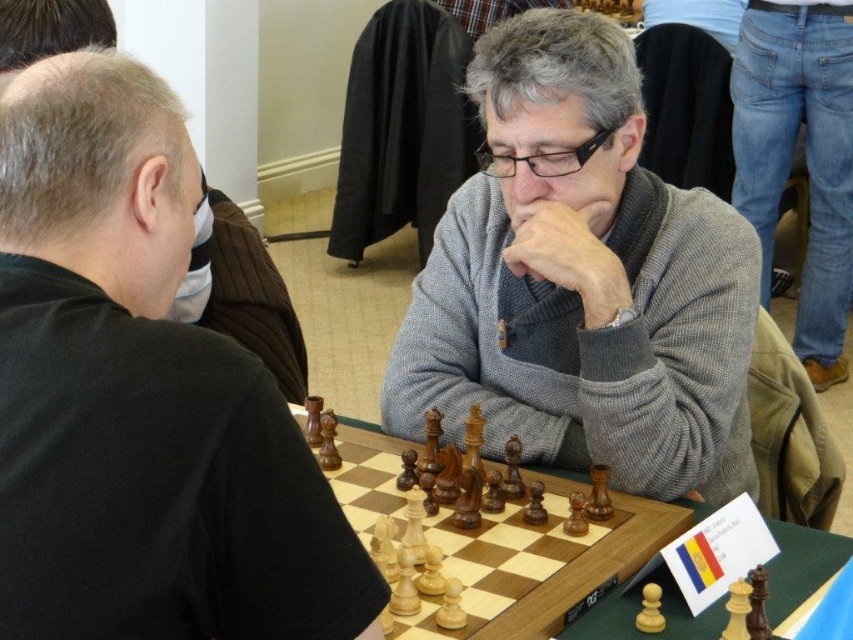
Question: Which object is farther from the camera taking this photo?

Choices:
 (A) black matte chess pieces at left
 (B) gray wool sweater at center

Answer: (B)

Question: Which point is closer to the camera?

Choices:
 (A) black matte chess pieces at left
 (B) gray wool sweater at center

Answer: (A)

Question: Is black matte chess pieces at left closer to the viewer compared to gray wool sweater at center?

Choices:
 (A) no
 (B) yes

Answer: (B)

Question: Among these objects, which one is nearest to the camera?

Choices:
 (A) gray wool sweater at center
 (B) black matte chess pieces at left

Answer: (B)

Question: In this image, where is black matte chess pieces at left located relative to gray wool sweater at center?

Choices:
 (A) right
 (B) left

Answer: (B)

Question: Can you confirm if black matte chess pieces at left is smaller than gray wool sweater at center?

Choices:
 (A) no
 (B) yes

Answer: (B)